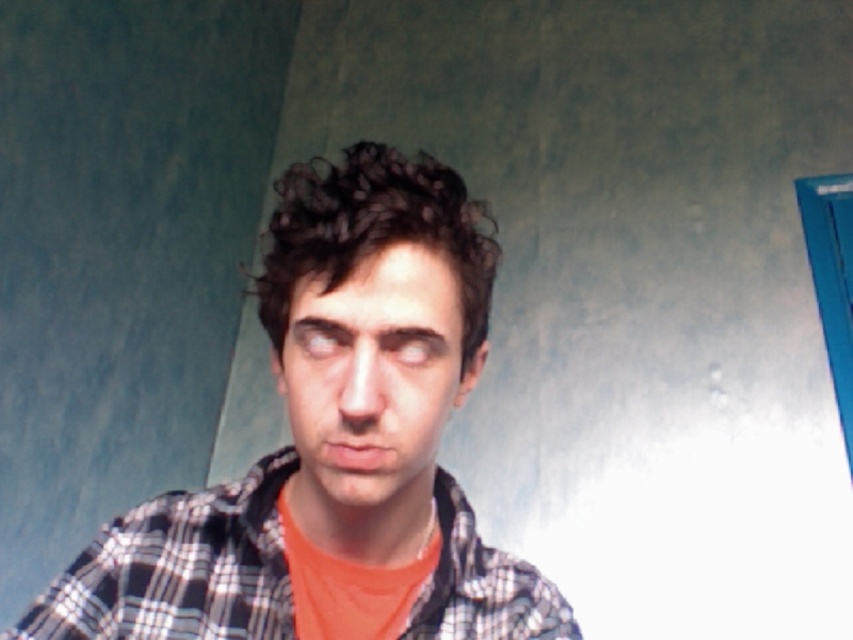
Can you confirm if plaid shirt at center is smaller than plaid cotton shirt at center?

Incorrect, plaid shirt at center is not smaller in size than plaid cotton shirt at center.

Is plaid shirt at center positioned before plaid cotton shirt at center?

Yes, plaid shirt at center is closer to the viewer.

Who is more distant from viewer, (451, 180) or (225, 572)?

The point (225, 572) is more distant.

The width and height of the screenshot is (853, 640). Find the location of `plaid shirt at center`. plaid shirt at center is located at coordinates click(334, 442).